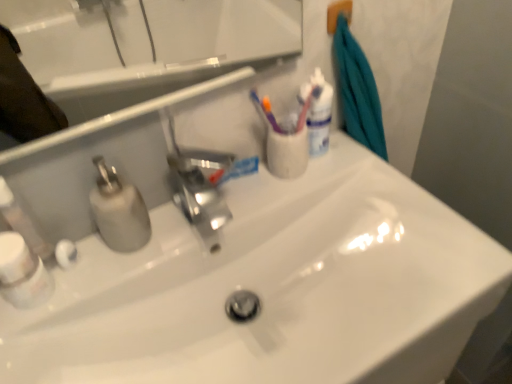
Locate an element on the screen. The width and height of the screenshot is (512, 384). empty space that is in between white glossy toothpaste at center and white plastic soap dispenser at left is located at coordinates (147, 224).